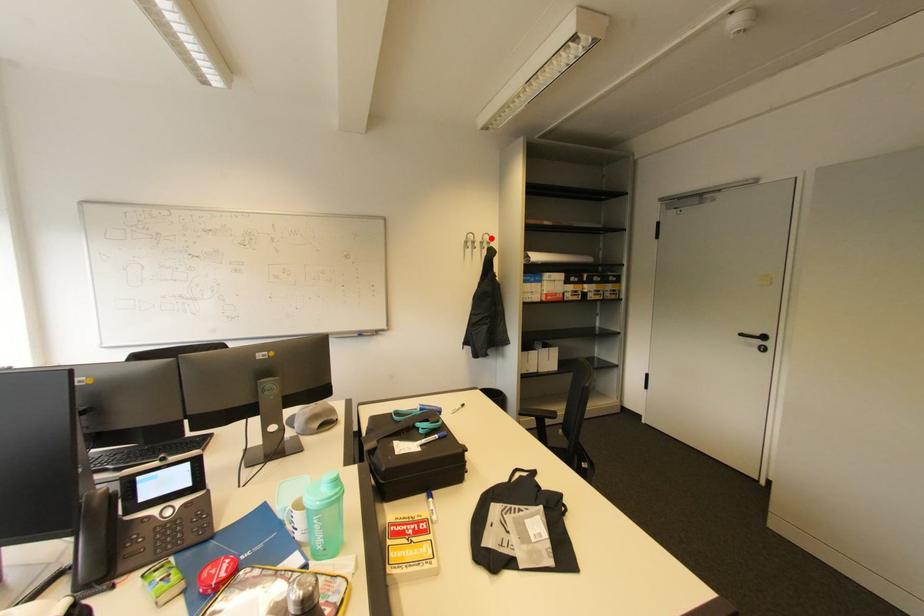
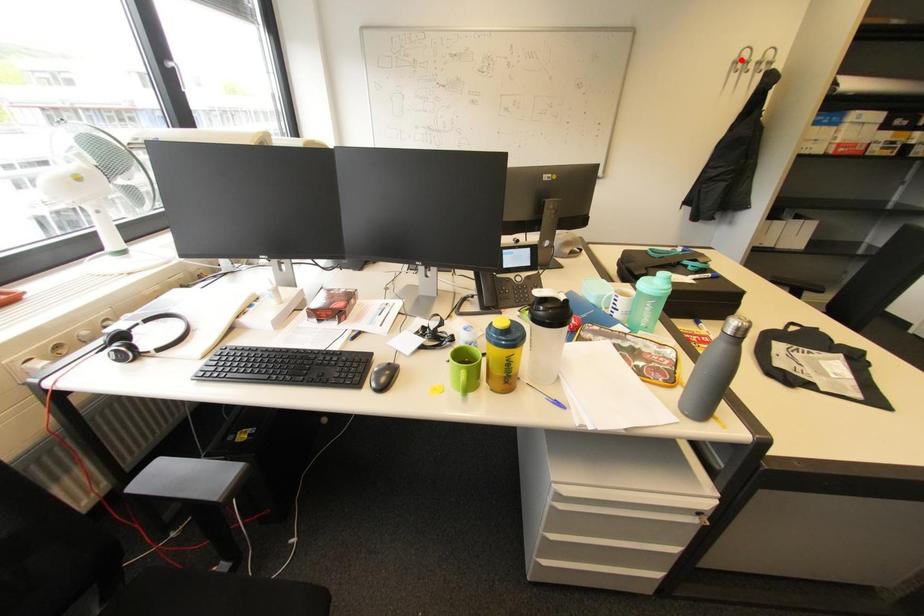
I am providing you with two images of the same scene from different viewpoints. A red point is marked on the first image and another point is marked on the second image. Are the points marked in image1 and image2 representing the same 3D position?

No